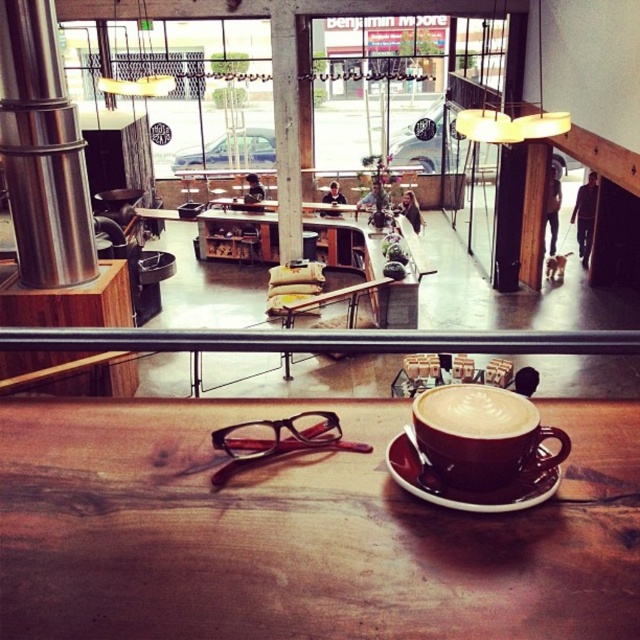
Is the position of cappuccino foam at center more distant than that of brown ceramic saucer at center?

No, it is in front of brown ceramic saucer at center.

Which is more to the left, cappuccino foam at center or brown ceramic saucer at center?

Positioned to the left is brown ceramic saucer at center.

Where is `cappuccino foam at center`? The height and width of the screenshot is (640, 640). cappuccino foam at center is located at coordinates (474, 412).

The image size is (640, 640). Describe the element at coordinates (481, 435) in the screenshot. I see `matte brown cup at center` at that location.

Can you confirm if matte brown cup at center is taller than cappuccino foam at center?

Indeed, matte brown cup at center has a greater height compared to cappuccino foam at center.

Identify the location of matte brown cup at center. (481, 435).

How far apart are wooden table at center and brown ceramic saucer at center?

9.14 inches

Locate an element on the screen. The height and width of the screenshot is (640, 640). wooden table at center is located at coordinates (278, 538).

Which is in front, point (154, 593) or point (518, 509)?

Point (154, 593) is in front.

I want to click on wooden table at center, so pos(278,538).